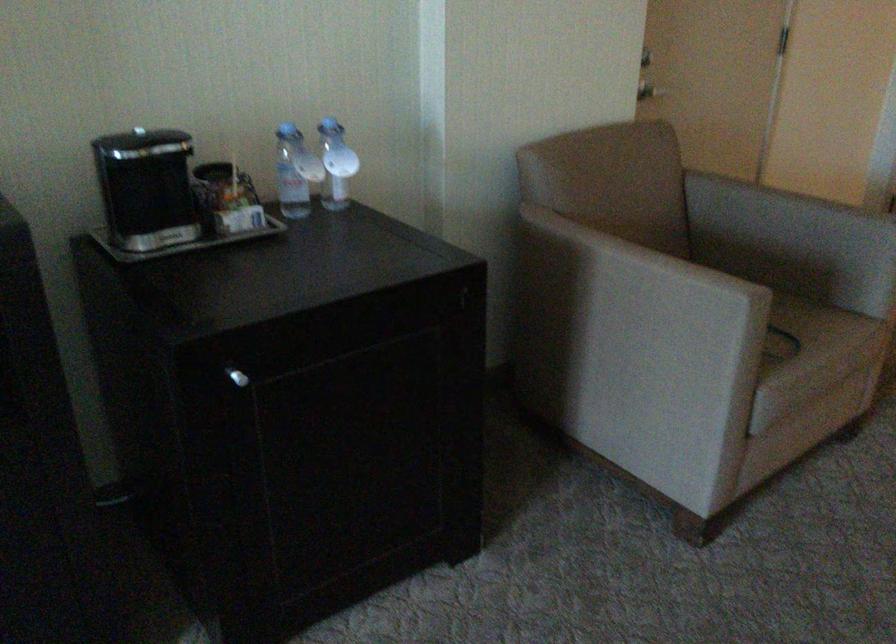
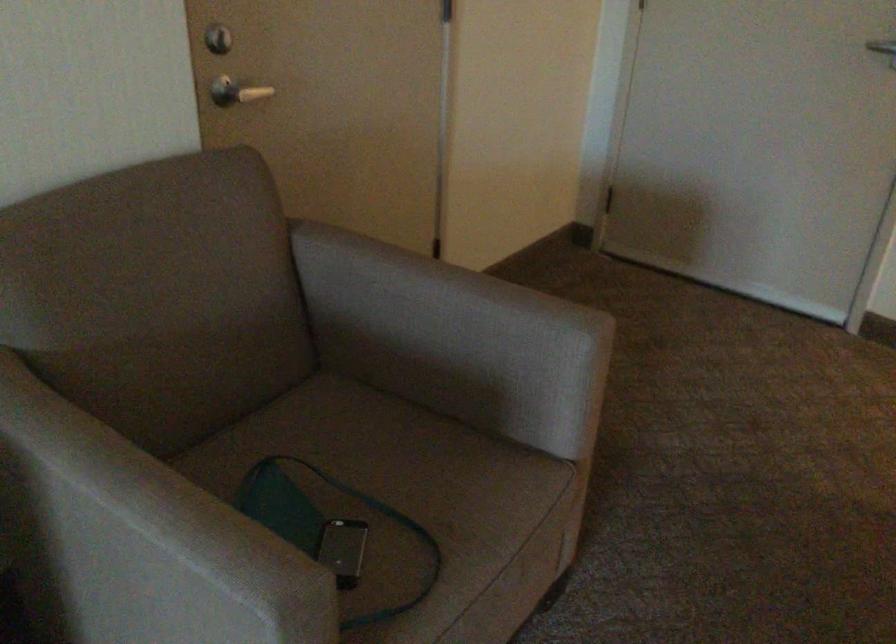
Where in the second image is the point corresponding to the point at 807,225 from the first image?

(453, 339)